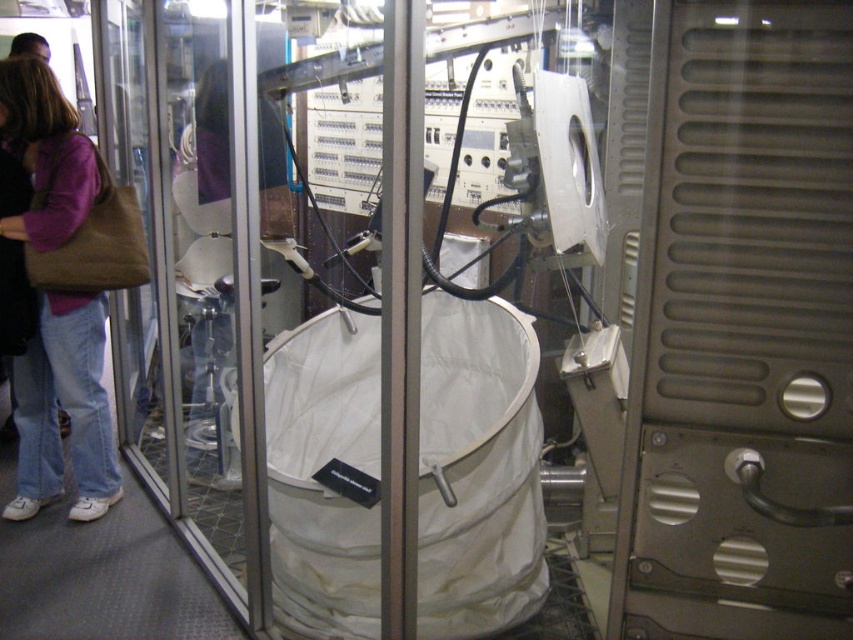
Question: From the image, what is the correct spatial relationship of transparent glass screen door at left in relation to matte brown bag at left?

Choices:
 (A) left
 (B) right

Answer: (B)

Question: Does transparent glass screen door at left appear under matte brown bag at left?

Choices:
 (A) yes
 (B) no

Answer: (B)

Question: Which point is closer to the camera taking this photo?

Choices:
 (A) (238, 160)
 (B) (22, 120)

Answer: (A)

Question: Can you confirm if transparent glass screen door at left is bigger than matte brown bag at left?

Choices:
 (A) yes
 (B) no

Answer: (A)